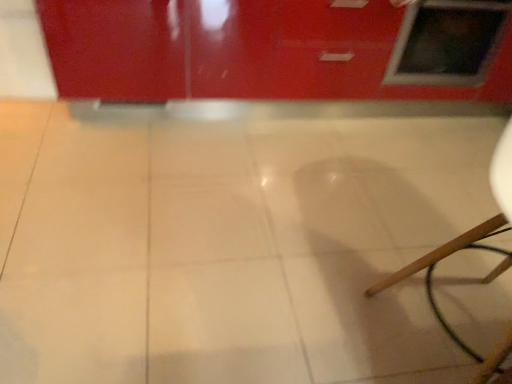
Question: Does point (450, 49) appear closer or farther from the camera than point (252, 168)?

Choices:
 (A) farther
 (B) closer

Answer: (A)

Question: Is matte glass window at upper right wider or thinner than white glossy tile at center?

Choices:
 (A) wide
 (B) thin

Answer: (B)

Question: Would you say matte glass window at upper right is inside or outside white glossy tile at center?

Choices:
 (A) inside
 (B) outside

Answer: (B)

Question: Visually, is white glossy tile at center positioned to the left or to the right of matte glass window at upper right?

Choices:
 (A) right
 (B) left

Answer: (B)

Question: From a real-world perspective, relative to matte glass window at upper right, is white glossy tile at center vertically above or below?

Choices:
 (A) below
 (B) above

Answer: (A)

Question: Is white glossy tile at center wider or thinner than matte glass window at upper right?

Choices:
 (A) thin
 (B) wide

Answer: (B)

Question: Considering the positions of point (245, 160) and point (490, 41), is point (245, 160) closer or farther from the camera than point (490, 41)?

Choices:
 (A) closer
 (B) farther

Answer: (A)